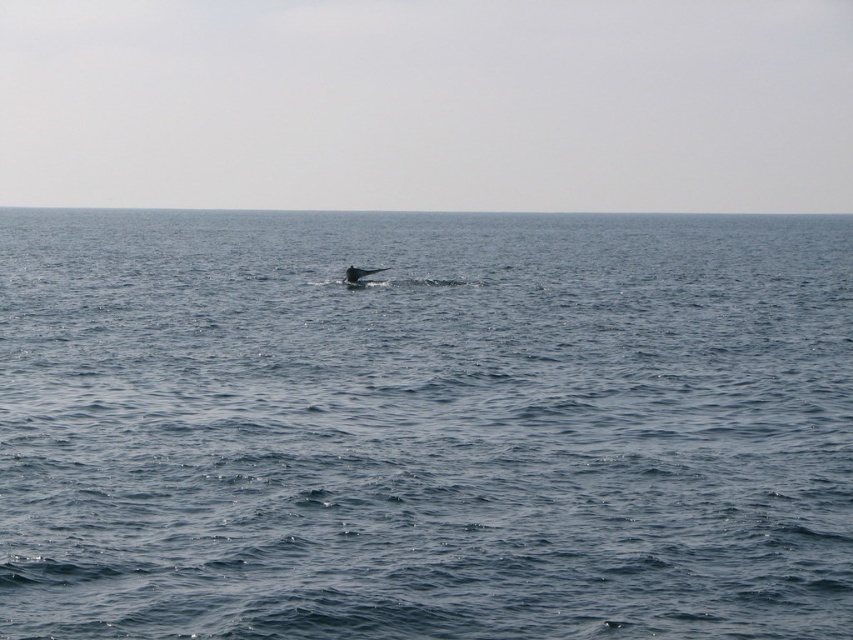
Is blue water at center thinner than gray matte whale at center?

In fact, blue water at center might be wider than gray matte whale at center.

Based on the photo, which is above, blue water at center or gray matte whale at center?

blue water at center

Find the location of a particular element. blue water at center is located at coordinates (424, 426).

Identify the location of blue water at center. This screenshot has height=640, width=853. (424, 426).